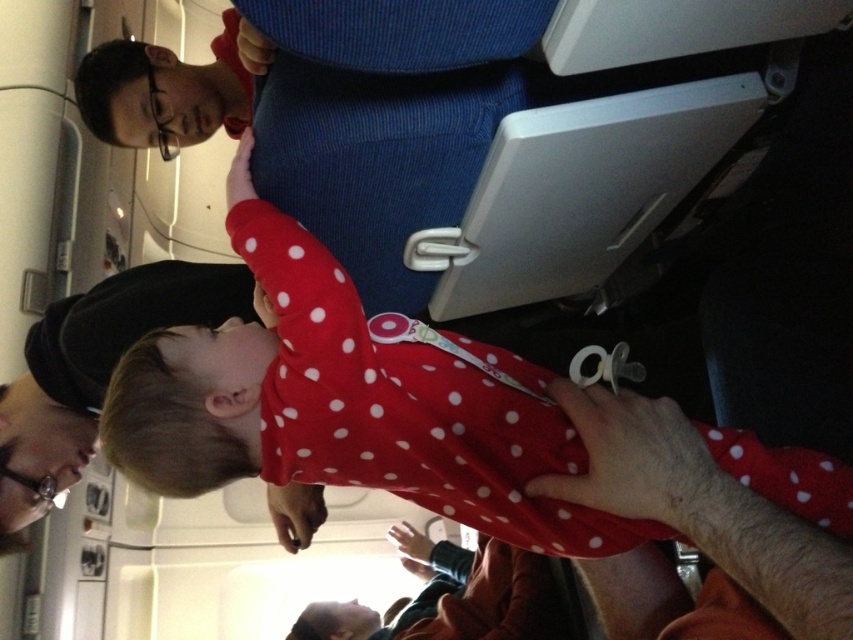
Question: Can you confirm if red polka dot onesie at center is positioned to the left of matte blue uniform at upper center?

Choices:
 (A) no
 (B) yes

Answer: (A)

Question: Among these points, which one is nearest to the camera?

Choices:
 (A) (234, 74)
 (B) (103, 449)

Answer: (B)

Question: Is red polka dot onesie at center above matte blue uniform at upper center?

Choices:
 (A) yes
 (B) no

Answer: (B)

Question: Is red polka dot onesie at center to the left of matte blue uniform at upper center from the viewer's perspective?

Choices:
 (A) no
 (B) yes

Answer: (A)

Question: Which of the following is the closest to the observer?

Choices:
 (A) matte blue uniform at upper center
 (B) red polka dot onesie at center

Answer: (B)